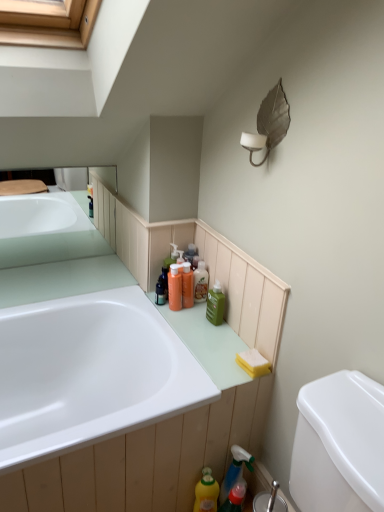
The height and width of the screenshot is (512, 384). I want to click on vacant area that is in front of translucent orange bottle at center, which is the 2th toiletry from left to right, so click(195, 322).